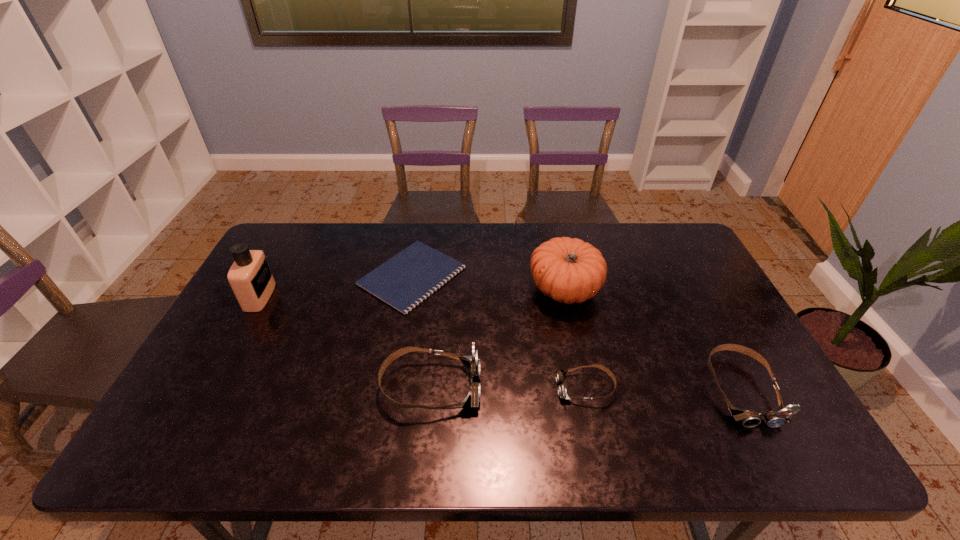
I want to click on blank area located 0.110m on the front-facing side of the fifth tallest object, so [x=513, y=388].

Where is `vacant space located on the front-facing side of the fifth tallest object`? vacant space located on the front-facing side of the fifth tallest object is located at coordinates (456, 388).

Locate an element on the screen. Image resolution: width=960 pixels, height=540 pixels. vacant position located on the front-facing side of the fifth tallest object is located at coordinates (480, 388).

Where is `free location located 0.220m on the right of the notepad`? The height and width of the screenshot is (540, 960). free location located 0.220m on the right of the notepad is located at coordinates (534, 275).

You are a GUI agent. You are given a task and a screenshot of the screen. Output one action in this format:
    pyautogui.click(x=<x>, y=<y>)
    Task: Click on the free region located on the back of the fifth shortest object
    This screenshot has width=960, height=540.
    Given the screenshot: What is the action you would take?
    pyautogui.click(x=557, y=254)

Locate an element on the screen. The width and height of the screenshot is (960, 540). vacant space located 0.100m on the front label of the tallest object is located at coordinates (304, 296).

The image size is (960, 540). What are the coordinates of `object that is at the far edge` in the screenshot? It's located at (405, 280).

Locate an element on the screen. This screenshot has height=540, width=960. object located in the left edge section of the desktop is located at coordinates (250, 277).

Locate an element on the screen. The image size is (960, 540). object located at the right edge is located at coordinates (748, 418).

I want to click on object located at the near right corner, so click(x=748, y=418).